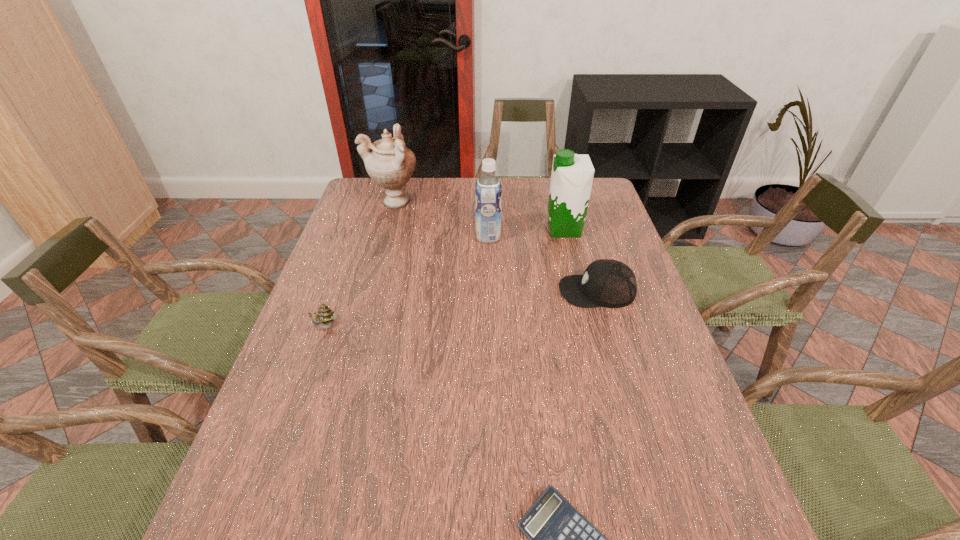
Locate an element on the screen. The height and width of the screenshot is (540, 960). empty space that is in between the third nearest object and the farthest object is located at coordinates (495, 246).

Identify the location of free point between the urn and the left soya milk. (441, 219).

Where is `the fifth closest object to the calculator`? the fifth closest object to the calculator is located at coordinates (390, 164).

The height and width of the screenshot is (540, 960). Find the location of `object that is the second nearest to the cap`. object that is the second nearest to the cap is located at coordinates [x=488, y=189].

The width and height of the screenshot is (960, 540). What are the coordinates of `free location that satisfies the following two spatial constraints: 1. on the front-facing side of the cap; 2. on the face of the second nearest object` in the screenshot? It's located at (608, 327).